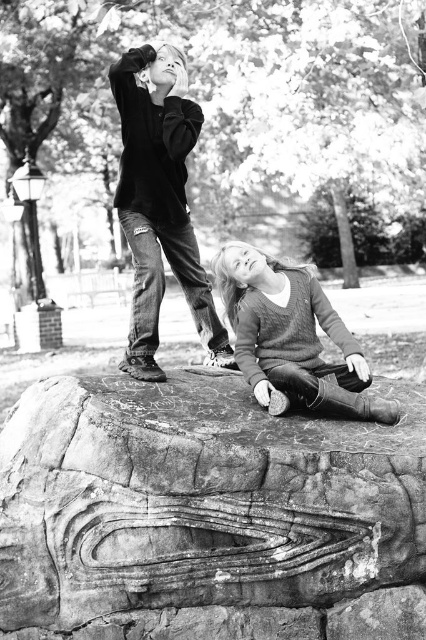
In the scene shown: Is dark cotton sweater at upper left shorter than knit sweater at center?

Incorrect, dark cotton sweater at upper left's height does not fall short of knit sweater at center's.

Where is `dark cotton sweater at upper left`? The width and height of the screenshot is (426, 640). dark cotton sweater at upper left is located at coordinates (160, 204).

Where is `dark cotton sweater at upper left`? This screenshot has height=640, width=426. dark cotton sweater at upper left is located at coordinates (160, 204).

Which is more to the right, rough stone carving at center or knit sweater at center?

knit sweater at center is more to the right.

Can you confirm if rough stone carving at center is positioned below knit sweater at center?

Yes.

The image size is (426, 640). What do you see at coordinates (198, 502) in the screenshot?
I see `rough stone carving at center` at bounding box center [198, 502].

I want to click on rough stone carving at center, so click(198, 502).

Measure the distance between ripped denim jeans at upper center and camera.

ripped denim jeans at upper center and camera are 3.99 meters apart.

Looking at this image, who is more distant from viewer, (x=391, y=420) or (x=143, y=253)?

Positioned behind is point (x=143, y=253).

Which is in front, point (123, 58) or point (166, 92)?

Point (123, 58)

The height and width of the screenshot is (640, 426). I want to click on ripped denim jeans at upper center, so click(x=291, y=337).